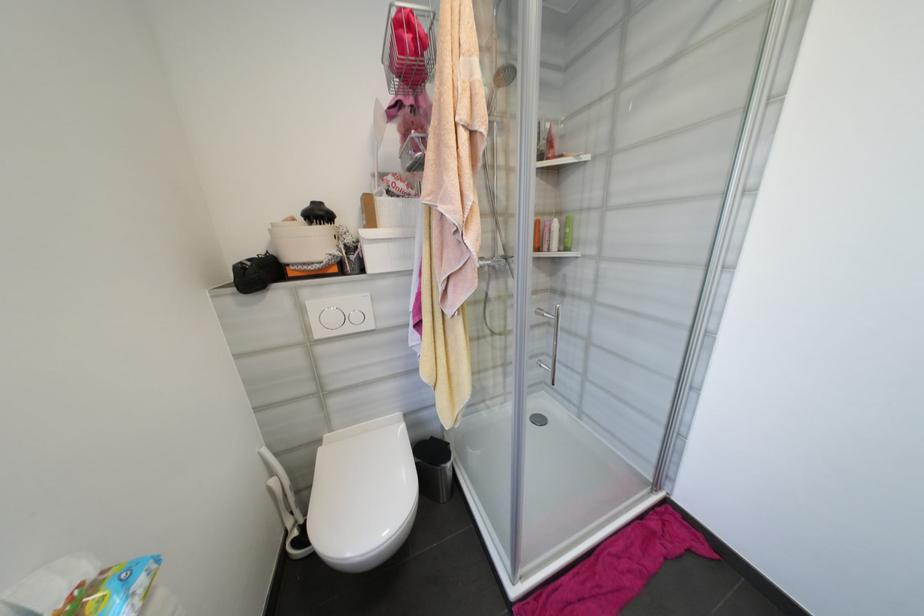
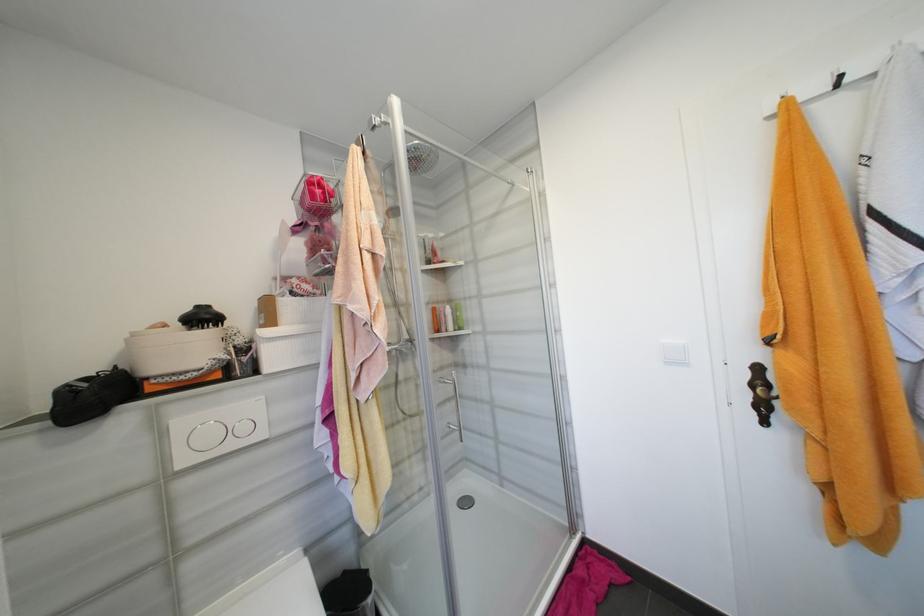
The point at (x=324, y=334) is marked in the first image. Where is the corresponding point in the second image?

(189, 463)